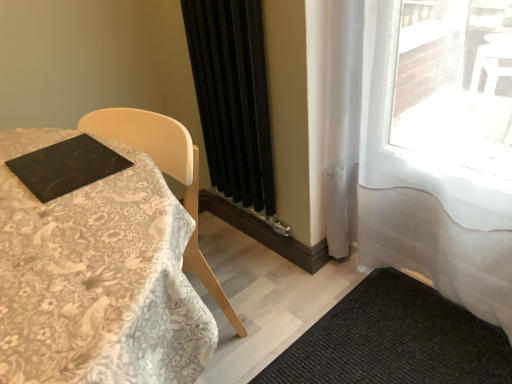
Question: Is black textured mat at lower right shorter than white sheer curtain at right, which is counted as the 2th curtain, starting from the left?

Choices:
 (A) yes
 (B) no

Answer: (A)

Question: Can you confirm if black textured mat at lower right is taller than white sheer curtain at right, which is counted as the 2th curtain, starting from the left?

Choices:
 (A) no
 (B) yes

Answer: (A)

Question: From a real-world perspective, is black textured mat at lower right below white sheer curtain at right, which is counted as the 2th curtain, starting from the left?

Choices:
 (A) no
 (B) yes

Answer: (B)

Question: Would you consider black textured mat at lower right to be distant from white sheer curtain at right, the first curtain from the right?

Choices:
 (A) yes
 (B) no

Answer: (B)

Question: Is the depth of black textured mat at lower right less than that of white sheer curtain at right, the first curtain from the right?

Choices:
 (A) yes
 (B) no

Answer: (B)

Question: Considering the positions of white lace tablecloth at left and white sheer curtain at right, the first curtain from the right, in the image, is white lace tablecloth at left wider or thinner than white sheer curtain at right, the first curtain from the right,?

Choices:
 (A) thin
 (B) wide

Answer: (B)

Question: From a real-world perspective, is white lace tablecloth at left positioned above or below white sheer curtain at right, which is counted as the 2th curtain, starting from the left?

Choices:
 (A) above
 (B) below

Answer: (B)

Question: Would you say white lace tablecloth at left is to the left or to the right of white sheer curtain at right, the first curtain from the right, in the picture?

Choices:
 (A) right
 (B) left

Answer: (B)

Question: Looking at the image, does white lace tablecloth at left seem bigger or smaller compared to white sheer curtain at right, the first curtain from the right?

Choices:
 (A) small
 (B) big

Answer: (B)

Question: Does point (304, 359) appear closer or farther from the camera than point (482, 213)?

Choices:
 (A) closer
 (B) farther

Answer: (B)

Question: From a real-world perspective, is black textured mat at lower right positioned above or below white sheer curtain at right, the first curtain from the right?

Choices:
 (A) below
 (B) above

Answer: (A)

Question: From the image's perspective, relative to white sheer curtain at right, which is counted as the 2th curtain, starting from the left, is black textured mat at lower right above or below?

Choices:
 (A) below
 (B) above

Answer: (A)

Question: In the image, is black textured mat at lower right on the left side or the right side of white sheer curtain at right, which is counted as the 2th curtain, starting from the left?

Choices:
 (A) left
 (B) right

Answer: (A)

Question: From a real-world perspective, is black matte curtain at center, the 2th curtain in the right-to-left sequence, physically located above or below white lace tablecloth at left?

Choices:
 (A) above
 (B) below

Answer: (A)

Question: Considering their positions, is black matte curtain at center, placed as the 1th curtain when sorted from left to right, located in front of or behind white lace tablecloth at left?

Choices:
 (A) front
 (B) behind

Answer: (B)